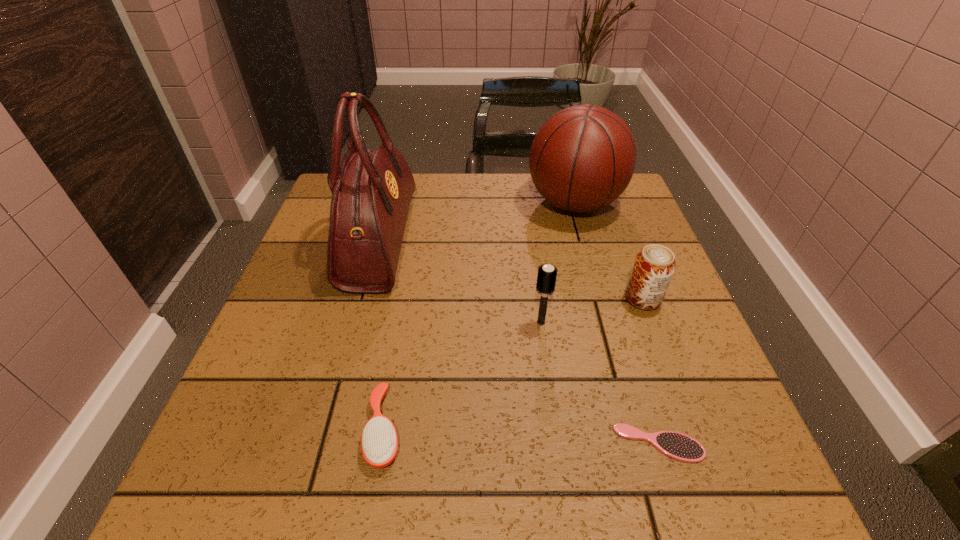
This screenshot has width=960, height=540. Find the location of `vacant region between the shortest hairbrush and the handbag`. vacant region between the shortest hairbrush and the handbag is located at coordinates (519, 342).

Find the location of a particular element. The image size is (960, 540). vacant point located between the leftmost hairbrush and the basketball is located at coordinates (480, 316).

Locate an element on the screen. Image resolution: width=960 pixels, height=540 pixels. vacant space in between the beer can and the handbag is located at coordinates point(512,269).

The height and width of the screenshot is (540, 960). Identify the location of free spot between the rightmost hairbrush and the fourth tallest object. (651, 371).

Identify the location of unoccupied area between the fifth shortest object and the handbag. (477, 222).

This screenshot has height=540, width=960. In order to click on vacant space that is in between the second tallest object and the shortest hairbrush in this screenshot , I will do `click(616, 323)`.

At what (x,y) coordinates should I click in order to perform the action: click on blank region between the shortest hairbrush and the third tallest object. Please return your answer as a coordinate pair (x, y). Looking at the image, I should click on (600, 383).

I want to click on empty location between the tallest hairbrush and the leftmost hairbrush, so click(x=463, y=375).

The height and width of the screenshot is (540, 960). Find the location of `free space between the basketball and the tallest object`. free space between the basketball and the tallest object is located at coordinates (477, 222).

What are the coordinates of `blank region between the shortest hairbrush and the second shortest hairbrush` in the screenshot? It's located at point(521,436).